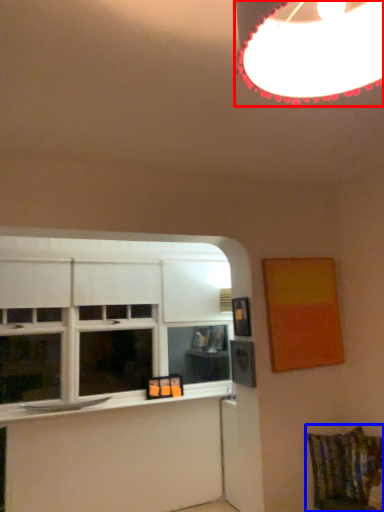
Question: Among these objects, which one is nearest to the camera, lamp (highlighted by a red box) or swivel chair (highlighted by a blue box)?

Choices:
 (A) lamp
 (B) swivel chair

Answer: (A)